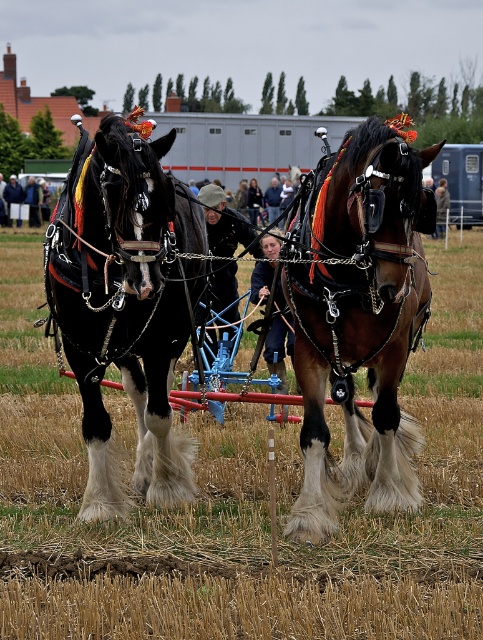
You are a farmer standing in the field and see the brown glossy horse at center and the dark brown leather jacket at center. Which object is positioned lower from the ground?

The brown glossy horse at center is positioned lower from the ground than the dark brown leather jacket at center.

You are a farmer standing in the field and need to reach both the dark brown leather jacket at center and the dark blue fabric at center. Which one is closer to you?

Both the dark brown leather jacket at center and the dark blue fabric at center are at the same distance from you since they are both located at the center of the image.

You are a farmer who wants to place a new scarecrow in the field. You notice the brown fluffy hay at center and the dark blue fabric at center. Which object should you place the scarecrow on top of to ensure it is visible from above?

The scarecrow should be placed on top of the dark blue fabric at center because the brown fluffy hay at center is below it, making the fabric the higher position for better visibility.